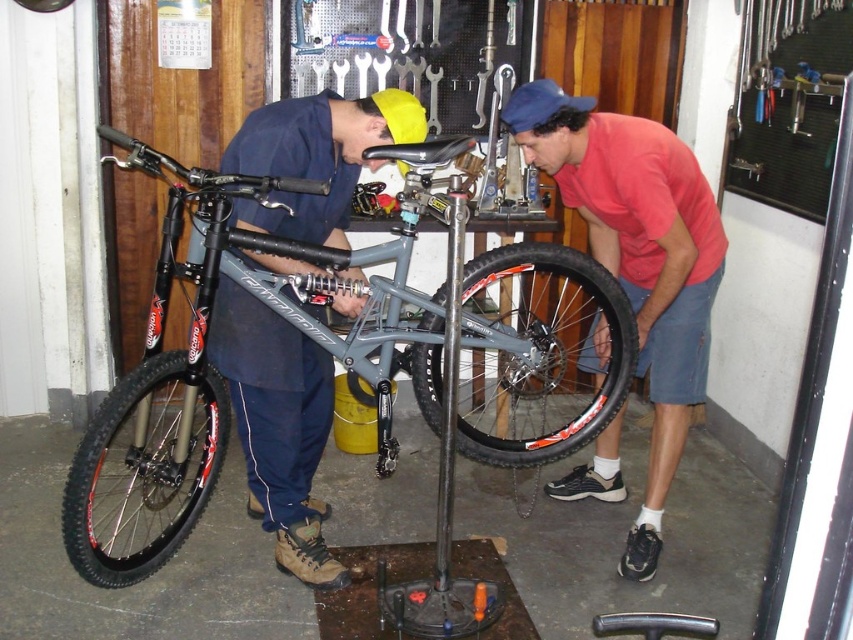
Who is lower down, red shirt at right or black rubber tire at lower left?

Positioned lower is black rubber tire at lower left.

Does point (718, 240) come behind point (120, 568)?

That is True.

Where is `red shirt at right`? The height and width of the screenshot is (640, 853). red shirt at right is located at coordinates (637, 259).

Does red shirt at right have a lesser width compared to black rubber tire at center?

Correct, red shirt at right's width is less than black rubber tire at center's.

Can you confirm if red shirt at right is shorter than black rubber tire at center?

Incorrect, red shirt at right's height does not fall short of black rubber tire at center's.

Is point (583, 161) positioned behind point (479, 461)?

No, (583, 161) is closer to viewer.

At what (x,y) coordinates should I click in order to perform the action: click on red shirt at right. Please return your answer as a coordinate pair (x, y). Looking at the image, I should click on (637, 259).

Does matte gray bicycle at center have a smaller size compared to matte blue shirt at center?

Actually, matte gray bicycle at center might be larger than matte blue shirt at center.

Is point (552, 336) positioned behind point (223, 368)?

That is True.

Does point (508, 252) come in front of point (259, 378)?

No, (508, 252) is further to viewer.

The width and height of the screenshot is (853, 640). What are the coordinates of `matte gray bicycle at center` in the screenshot? It's located at (218, 372).